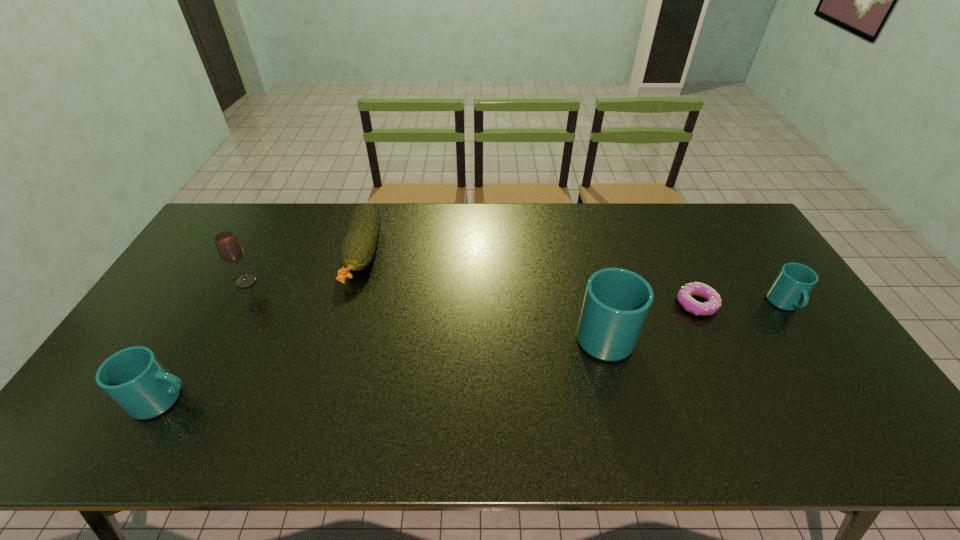
Find the location of a particular element. The image size is (960, 540). vacant space located 0.270m on the handle side of the nearest cup is located at coordinates (305, 400).

Find the location of a particular element. The height and width of the screenshot is (540, 960). vacant space located on the handle side of the fourth object from left to right is located at coordinates (589, 280).

I want to click on free region located 0.230m on the handle side of the fourth object from left to right, so click(583, 253).

This screenshot has height=540, width=960. What are the coordinates of `free spot located on the handle side of the fourth object from left to right` in the screenshot? It's located at (581, 244).

I want to click on free point located 0.200m on the handle side of the rightmost cup, so click(x=835, y=380).

The image size is (960, 540). In order to click on free space located on the right of the glass drink container in this screenshot , I will do click(x=331, y=281).

The height and width of the screenshot is (540, 960). Find the location of `free space located 0.130m at the blossom end of the third object from left to right`. free space located 0.130m at the blossom end of the third object from left to right is located at coordinates (342, 326).

Find the location of a particular element. The height and width of the screenshot is (540, 960). vacant space located 0.240m on the back of the second object from right to left is located at coordinates (665, 240).

Identify the location of object that is at the far edge. click(358, 248).

Find the location of a particular element. object that is at the near edge is located at coordinates (135, 378).